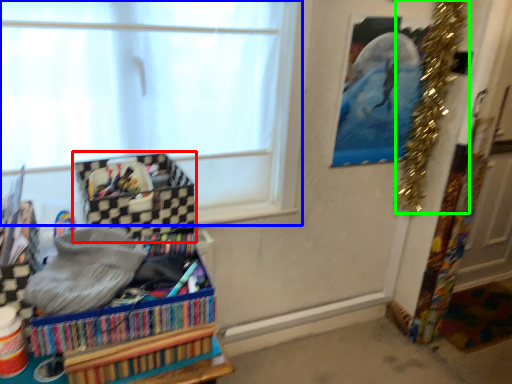
Question: Considering the real-world distances, which object is closest to storage box (highlighted by a red box)? window (highlighted by a blue box) or christmas decoration (highlighted by a green box).

Choices:
 (A) window
 (B) christmas decoration

Answer: (A)